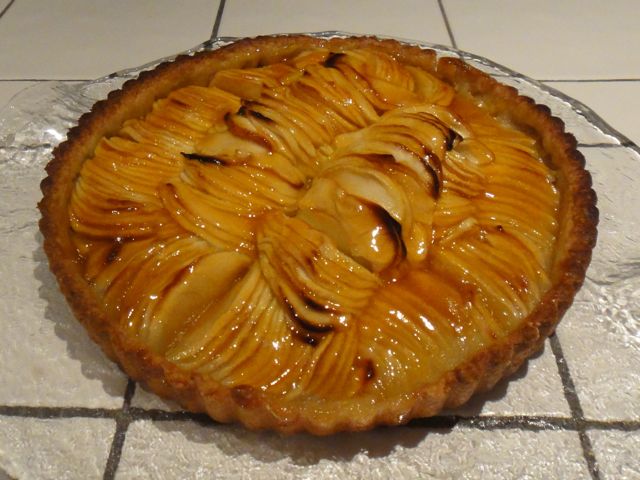
Where is `glass tray`? glass tray is located at coordinates (618, 229), (35, 352).